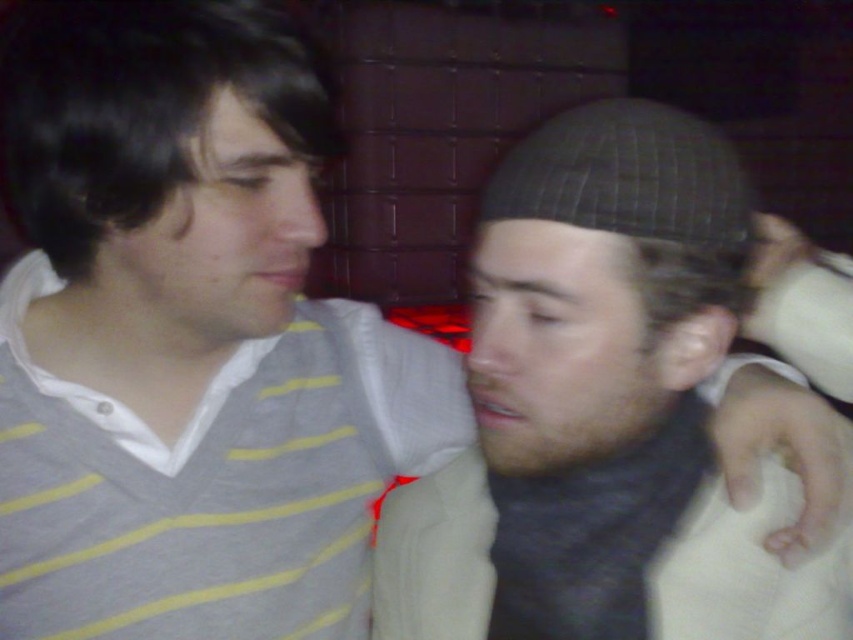
You are a photographer aiming to capture the perfect shot of the dark gray knit cap at center. Given that your camera has a focal length of 50mm and an aperture of f2.8, what is the minimum distance you need to be from the cap to ensure it fills the frame? Assume the cap is 12cm in diameter and the sensor size is 24mm x 36mm.

The minimum distance required is approximately 1.6 meters. This is calculated by using the formula for depth of field and sensor coverage, ensuring the 12cm cap fits within the 24mm sensor width at 50mm focal length.

You are a photographer setting up a photo shoot in a studio. You have two hats to arrange on a mannequin head at center. The hats are the dark gray knit cap at center and the black textured hat at center. According to the scene description, which hat should you place on top so that it appears in front when viewed from the front?

The dark gray knit cap at center should be placed on top so that it appears in front of the black textured hat at center when viewed from the front, as it is described to be in front in the scene.

You are standing in a bar and see two people. The person on the left is wearing a light gray sweater with yellow horizontal stripes, and the person on the right is wearing a dark beanie and a dark scarf with a white garment. The dark gray knit cap at center is located at point (602, 412). Can you determine if the dark gray knit cap at center is worn by the person on the left or the person on the right?

The dark gray knit cap at center is located at point (602, 412), which corresponds to the person on the right wearing a dark beanie and dark scarf. Therefore, the dark gray knit cap at center is worn by the person on the right.